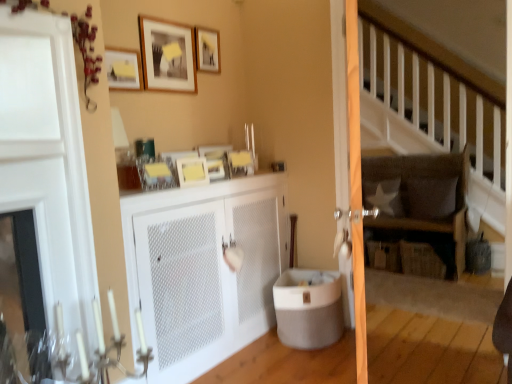
Question: Considering the positions of point (231, 327) and point (165, 21), is point (231, 327) closer or farther from the camera than point (165, 21)?

Choices:
 (A) farther
 (B) closer

Answer: (A)

Question: Which is correct: white mesh cabinet at center is inside matte white picture frame at upper center, acting as the 2th picture frame starting from the top, or outside of it?

Choices:
 (A) inside
 (B) outside

Answer: (B)

Question: Estimate the real-world distances between objects in this image. Which object is closer to the matte white picture frame at upper center, which is the 3th picture frame in bottom-to-top order?

Choices:
 (A) matte gray tub at lower center
 (B) white glossy door at left
 (C) matte yellow picture frame at upper center, positioned as the fourth picture frame in top-to-bottom order
 (D) matte white screen door at center
 (E) white mesh cabinet at center

Answer: (C)

Question: Considering the real-world distances, which object is farthest from the white mesh cabinet at center?

Choices:
 (A) matte gray tub at lower center
 (B) matte yellow picture frame at upper left, the 2th picture frame in the bottom-to-top sequence
 (C) white fabric pillow at center-right, acting as the second pillow starting from the right
 (D) matte wooden picture frame at upper center, the first picture frame in the top-to-bottom sequence
 (E) white glossy door at left

Answer: (C)